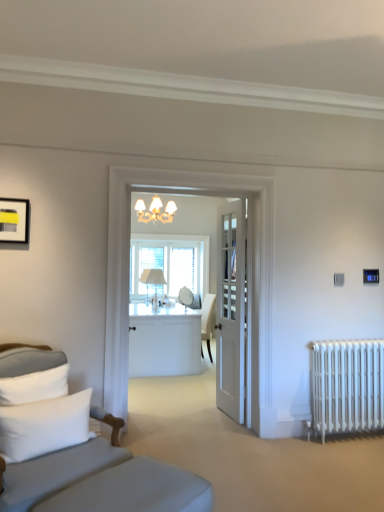
What are the coordinates of `white glossy desk at center` in the screenshot? It's located at (164, 341).

This screenshot has width=384, height=512. Describe the element at coordinates (44, 426) in the screenshot. I see `white soft pillow at lower left` at that location.

In order to face white soft pillow at lower left, should I rotate leftwards or rightwards?

To align with it, rotate left about 18.198°.

Image resolution: width=384 pixels, height=512 pixels. I want to click on gray fabric studio couch at left, so click(75, 450).

The width and height of the screenshot is (384, 512). What do you see at coordinates (75, 450) in the screenshot? I see `gray fabric studio couch at left` at bounding box center [75, 450].

This screenshot has height=512, width=384. What do you see at coordinates (14, 220) in the screenshot?
I see `matte black picture frame at upper left` at bounding box center [14, 220].

What do you see at coordinates (347, 386) in the screenshot? This screenshot has height=512, width=384. I see `white metal radiator at lower right` at bounding box center [347, 386].

At what (x,y) coordinates should I click in order to perform the action: click on white glossy desk at center. Please return your answer as a coordinate pair (x, y). Image resolution: width=384 pixels, height=512 pixels. Looking at the image, I should click on (164, 341).

In the scene shown: Which object is more forward, white wooden door at center or clear glass window at center?

white wooden door at center.

Which object is positioned more to the left, white wooden door at center or clear glass window at center?

Positioned to the left is clear glass window at center.

Who is shorter, white wooden door at center or clear glass window at center?

Standing shorter between the two is clear glass window at center.

In the image, is white wooden door at center on the left side or the right side of gray fabric studio couch at left?

From the image, it's evident that white wooden door at center is to the right of gray fabric studio couch at left.

Based on their sizes in the image, would you say white wooden door at center is bigger or smaller than gray fabric studio couch at left?

Considering their sizes, white wooden door at center takes up less space than gray fabric studio couch at left.

Is white wooden door at center located outside gray fabric studio couch at left?

white wooden door at center lies outside gray fabric studio couch at left's area.

In terms of width, does white fabric table lamp at center look wider or thinner when compared to white metal radiator at lower right?

Answer: In the image, white fabric table lamp at center appears to be wider than white metal radiator at lower right.

Is point (158, 269) positioned before point (383, 381)?

No, (158, 269) is further to viewer.

From the image's perspective, is white fabric table lamp at center beneath white metal radiator at lower right?

No, from the image's perspective, white fabric table lamp at center is not below white metal radiator at lower right.

The image size is (384, 512). In the image, there is a white fabric table lamp at center. In order to click on radiator below it (from the image's perspective) in this screenshot , I will do `click(347, 386)`.

Is clear glass window at center a part of white soft pillow at lower left?

No, white soft pillow at lower left does not contain clear glass window at center.

Is white soft pillow at lower left positioned with its back to clear glass window at center?

No, white soft pillow at lower left is not facing the opposite direction of clear glass window at center.

Is the depth of white soft pillow at lower left greater than that of clear glass window at center?

No.

Considering the relative positions of white soft pillow at lower left and clear glass window at center in the image provided, is white soft pillow at lower left to the right of clear glass window at center from the viewer's perspective?

No.

Between white fabric table lamp at center and white soft pillow at lower left, which one has smaller size?

white soft pillow at lower left.

How much distance is there between white fabric table lamp at center and white soft pillow at lower left?

white fabric table lamp at center is 9.75 feet from white soft pillow at lower left.

Can you confirm if white fabric table lamp at center is positioned to the left of white soft pillow at lower left?

In fact, white fabric table lamp at center is to the right of white soft pillow at lower left.

Does white wooden door at center have a greater width compared to white soft pillow at lower left?

No, white wooden door at center is not wider than white soft pillow at lower left.

Considering the sizes of objects white wooden door at center and white soft pillow at lower left in the image provided, who is taller, white wooden door at center or white soft pillow at lower left?

white wooden door at center is taller.

Is point (237, 300) positioned behind point (79, 412)?

Yes.

Is the position of gray fabric studio couch at left more distant than that of white soft pillow at lower left?

No, it is not.

From a real-world perspective, between gray fabric studio couch at left and white soft pillow at lower left, who is vertically higher?

In real-world perspective, white soft pillow at lower left is above.

Is gray fabric studio couch at left far from white soft pillow at lower left?

gray fabric studio couch at left is actually quite close to white soft pillow at lower left.

Find the location of a particular element. Image resolution: width=384 pixels, height=512 pixels. studio couch beneath the white soft pillow at lower left (from a real-world perspective) is located at coordinates (75, 450).

Locate an element on the screen. door below the clear glass window at center (from the image's perspective) is located at coordinates (231, 310).

You are a GUI agent. You are given a task and a screenshot of the screen. Output one action in this format:
    pyautogui.click(x=<x>, y=<y>)
    Task: Click on the studio couch below the white wooden door at center (from a real-world perspective)
    
    Given the screenshot: What is the action you would take?
    pyautogui.click(x=75, y=450)

Looking at the image, which one is located closer to white glossy desk at center, white soft pillow at lower left or white wooden door at center?

white wooden door at center is positioned closer to the anchor white glossy desk at center.

Looking at the image, which one is located closer to clear glass window at center, white soft pillow at lower left or matte black picture frame at upper left?

The object closer to clear glass window at center is matte black picture frame at upper left.

Considering their positions, is matte black picture frame at upper left positioned closer to gray fabric studio couch at left than white soft pillow at lower left?

white soft pillow at lower left.

Consider the image. Based on their spatial positions, is white wooden door at center or white fabric table lamp at center further from matte black picture frame at upper left?

Based on the image, white fabric table lamp at center appears to be further to matte black picture frame at upper left.

Based on their spatial positions, is matte black picture frame at upper left or white wooden door at center further from white soft pillow at lower left?

white wooden door at center is positioned further to the anchor white soft pillow at lower left.

Which object lies nearer to the anchor point white wooden door at center, white glossy desk at center or clear glass window at center?

The object closer to white wooden door at center is clear glass window at center.

From the image, which object appears to be farther from white fabric table lamp at center, gray fabric studio couch at left or clear glass window at center?

The object further to white fabric table lamp at center is gray fabric studio couch at left.

Considering their positions, is clear glass window at center positioned closer to white glossy desk at center than white soft pillow at lower left?

clear glass window at center is closer to white glossy desk at center.

Find the location of a particular element. Image resolution: width=384 pixels, height=512 pixels. table lamp between white wooden door at center and clear glass window at center along the z-axis is located at coordinates (153, 278).

This screenshot has width=384, height=512. I want to click on radiator between white soft pillow at lower left and white fabric table lamp at center along the z-axis, so click(347, 386).

Find the location of a particular element. The width and height of the screenshot is (384, 512). door between gray fabric studio couch at left and white fabric table lamp at center from front to back is located at coordinates click(x=231, y=310).

Locate an element on the screen. studio couch between matte black picture frame at upper left and white metal radiator at lower right from left to right is located at coordinates (75, 450).